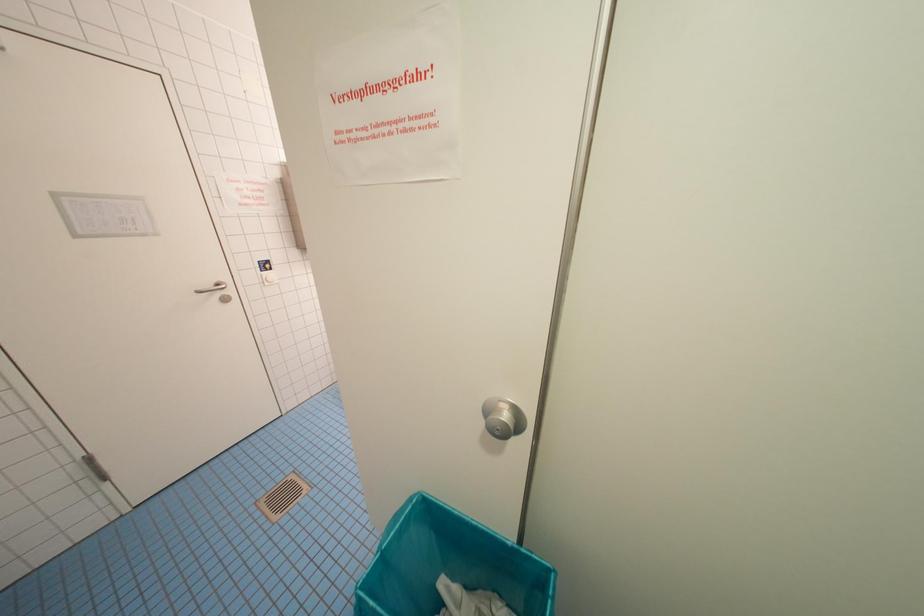
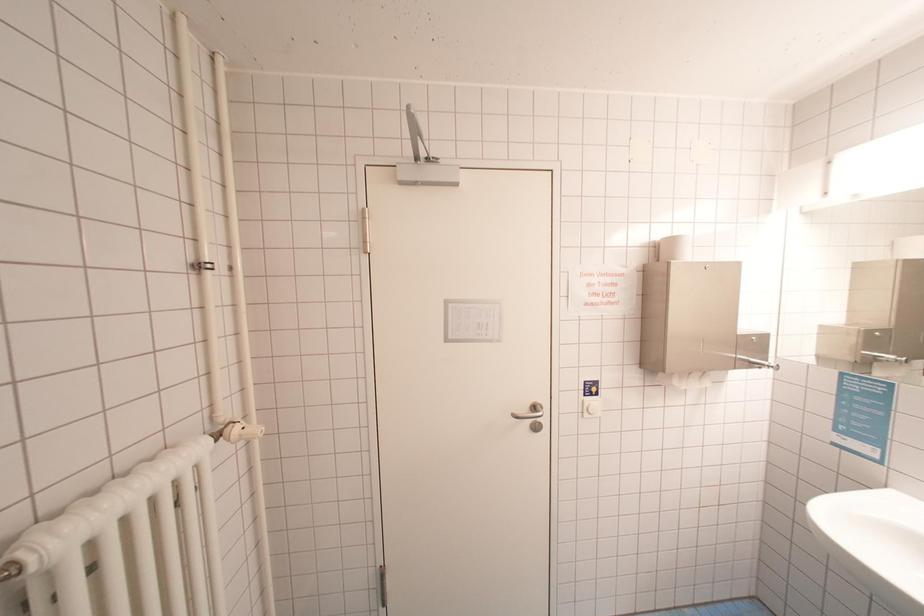
Question: The images are taken continuously from a first-person perspective. In which direction is your viewpoint rotating?

Choices:
 (A) Left
 (B) Right
 (C) Up
 (D) Down

Answer: (A)